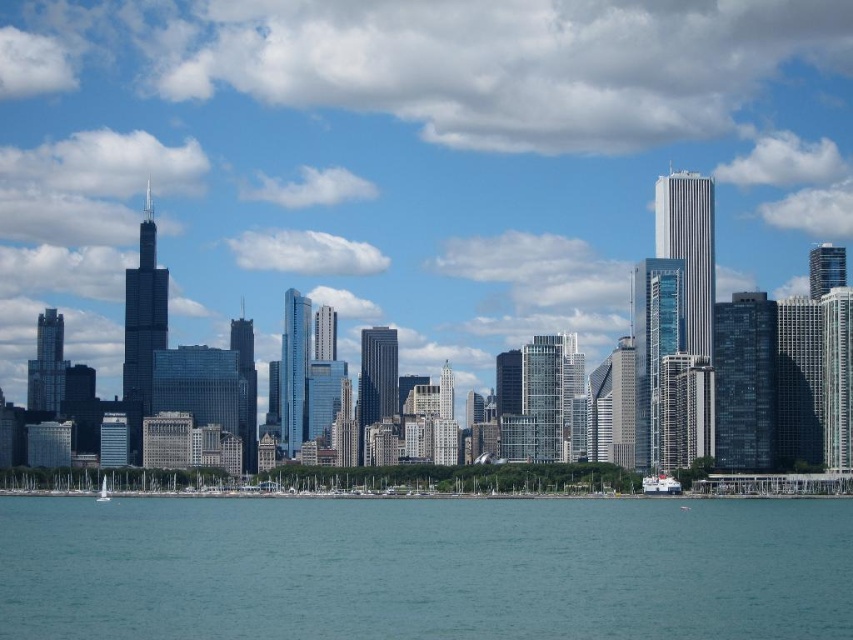
Question: Which object is closer to the camera taking this photo?

Choices:
 (A) blue water at lower center
 (B) white matte boat at lower right

Answer: (A)

Question: Where is blue water at lower center located in relation to white glossy sailboat at lower left in the image?

Choices:
 (A) right
 (B) left

Answer: (A)

Question: Does blue water at lower center appear on the right side of white glossy sailboat at lower left?

Choices:
 (A) no
 (B) yes

Answer: (B)

Question: Which point is closer to the camera taking this photo?

Choices:
 (A) (531, 596)
 (B) (96, 499)
 (C) (647, 477)

Answer: (A)

Question: Which point is farther from the camera taking this photo?

Choices:
 (A) (32, 609)
 (B) (654, 492)

Answer: (A)

Question: Considering the relative positions of blue water at lower center and white glossy sailboat at lower left in the image provided, where is blue water at lower center located with respect to white glossy sailboat at lower left?

Choices:
 (A) above
 (B) below

Answer: (B)